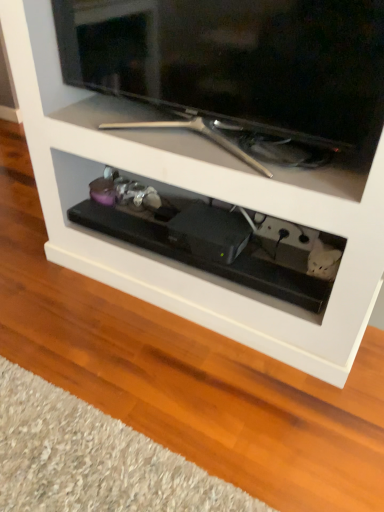
Find the location of a particular element. The height and width of the screenshot is (512, 384). vacant space situated above black plastic drawer at center (from a real-world perspective) is located at coordinates (173, 243).